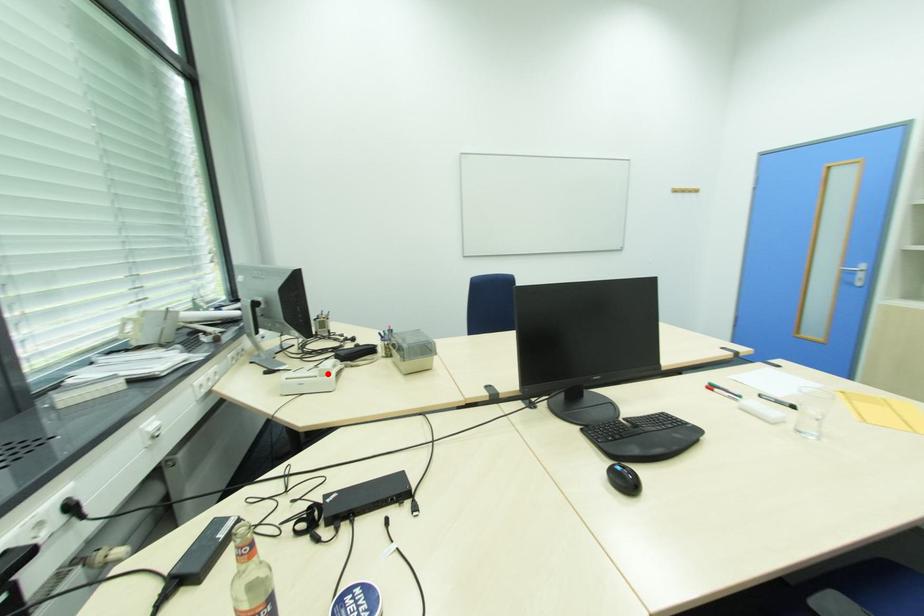
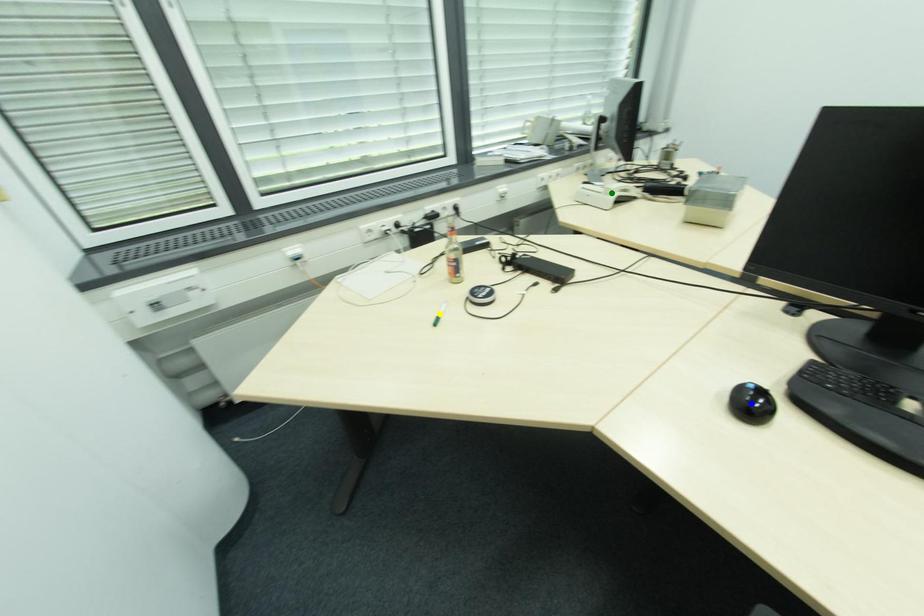
Question: I am providing you with two images of the same scene from different viewpoints. A red point is marked on the first image. You are given multiple points on the second image. Which mark in image 2 goes with the point in image 1?

Choices:
 (A) yellow point
 (B) blue point
 (C) green point

Answer: (C)